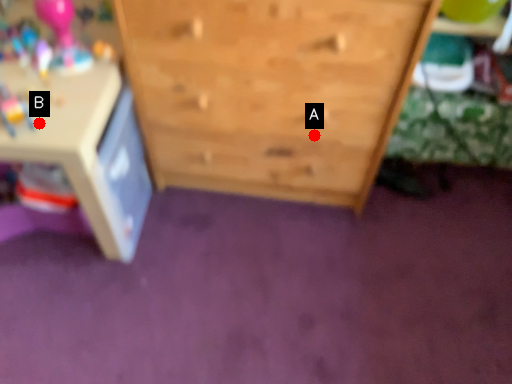
Question: Two points are circled on the image, labeled by A and B beside each circle. Among these points, which one is farthest from the camera?

Choices:
 (A) A is further
 (B) B is further

Answer: (A)